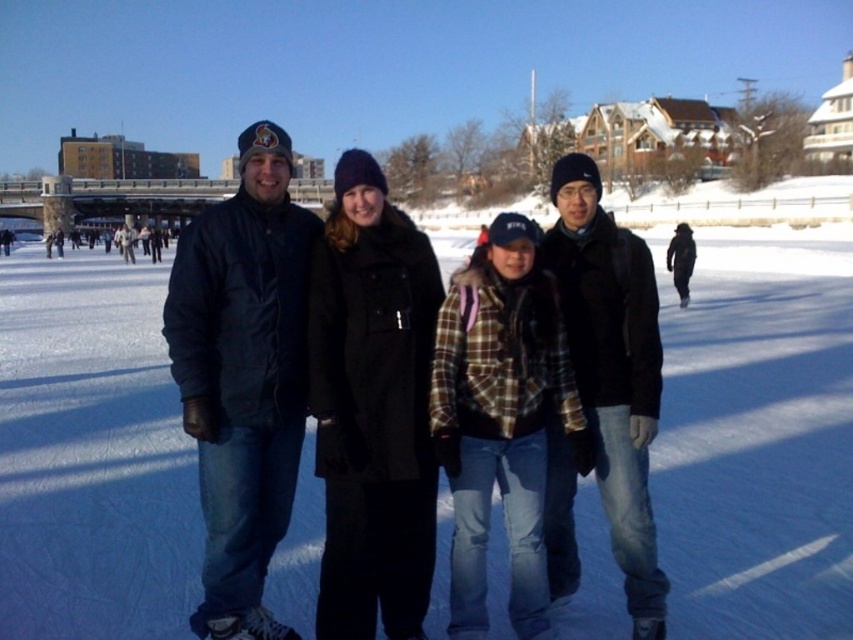
Does dark blue jacket at left have a smaller size compared to matte black jacket at center?

Yes.

Between point (230, 365) and point (248, 138), which one is positioned in front?

Point (230, 365) is more forward.

Where is `dark blue jacket at left`? The width and height of the screenshot is (853, 640). dark blue jacket at left is located at coordinates (242, 376).

Is dark blue jacket at left thinner than matte black jacket at left?

Indeed, dark blue jacket at left has a lesser width compared to matte black jacket at left.

Does point (252, 337) come in front of point (56, 243)?

Yes, it is.

Measure the distance between dark blue jacket at left and camera.

dark blue jacket at left and camera are 4.89 meters apart.

At what (x,y) coordinates should I click in order to perform the action: click on dark blue jacket at left. Please return your answer as a coordinate pair (x, y). This screenshot has height=640, width=853. Looking at the image, I should click on (242, 376).

Is matte black jacket at center further to the viewer compared to dark blue jacket at center?

That is True.

Locate an element on the screen. The image size is (853, 640). matte black jacket at center is located at coordinates (612, 362).

Identify the location of matte black jacket at center. (612, 362).